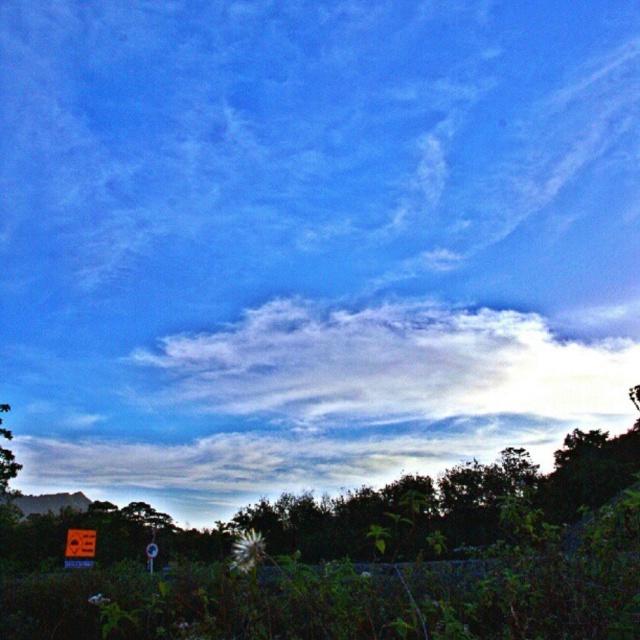
You are a photographer standing in the forest and want to capture both the white fluffy cloud at center and the metallic reflective sign at lower left in a single shot. Which object will appear larger in your photo?

The white fluffy cloud at center will appear larger in the photo because it is closer to the viewer than the metallic reflective sign at lower left, making it appear bigger despite its actual size.

You are standing in the serene outdoor scene with the vast sky and dense forest. You notice a point marked at coordinates (80,547). What object is located at that point?

The point at coordinates (80,547) indicates a metallic red sign at the bottom left.

You are planning to take a photo of the white fluffy cloud at center and the metallic reflective sign at lower left. Which object should you focus on first if you want both to be in sharp focus, considering their sizes?

The white fluffy cloud at center is larger in size than the metallic reflective sign at lower left, so you should focus on the larger object first to ensure both are in sharp focus.